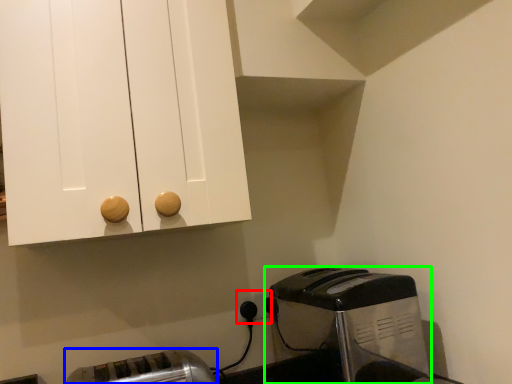
Question: Which is farther away from electric outlet (highlighted by a red box)? toaster (highlighted by a blue box) or toaster (highlighted by a green box)?

Choices:
 (A) toaster
 (B) toaster

Answer: (A)